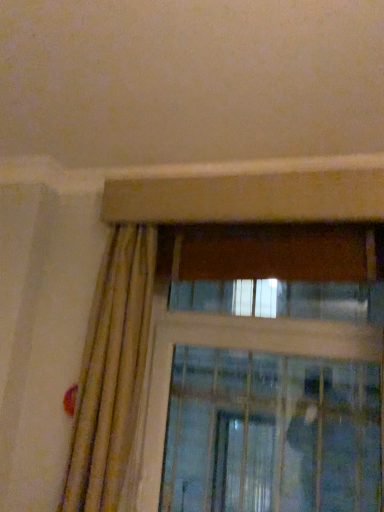
Question: Does point (117, 393) appear closer or farther from the camera than point (254, 391)?

Choices:
 (A) closer
 (B) farther

Answer: (A)

Question: Based on their positions, is beige textured curtain at left located to the left or right of clear glass screen door at upper center?

Choices:
 (A) left
 (B) right

Answer: (A)

Question: Is beige textured curtain at left inside or outside of clear glass screen door at upper center?

Choices:
 (A) inside
 (B) outside

Answer: (B)

Question: Is clear glass screen door at upper center taller or shorter than beige textured curtain at left?

Choices:
 (A) short
 (B) tall

Answer: (A)

Question: From the image's perspective, relative to beige textured curtain at left, is clear glass screen door at upper center above or below?

Choices:
 (A) above
 (B) below

Answer: (B)

Question: Relative to beige textured curtain at left, is clear glass screen door at upper center in front or behind?

Choices:
 (A) front
 (B) behind

Answer: (B)

Question: Visually, is clear glass screen door at upper center positioned to the left or to the right of beige textured curtain at left?

Choices:
 (A) right
 (B) left

Answer: (A)